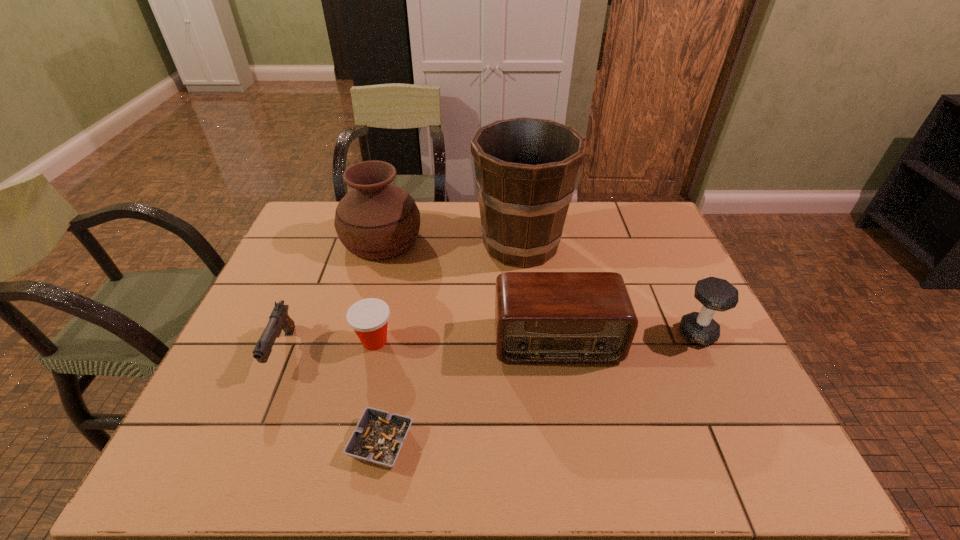
Where is `vacant space at the far edge of the desktop`? vacant space at the far edge of the desktop is located at coordinates (576, 234).

Image resolution: width=960 pixels, height=540 pixels. In order to click on blank space at the near edge of the desktop in this screenshot , I will do `click(462, 466)`.

At what (x,y) coordinates should I click in order to perform the action: click on blank space at the left edge. Please return your answer as a coordinate pair (x, y). The height and width of the screenshot is (540, 960). Looking at the image, I should click on (190, 426).

Where is `blank space at the right edge of the desktop`? The width and height of the screenshot is (960, 540). blank space at the right edge of the desktop is located at coordinates (668, 329).

The height and width of the screenshot is (540, 960). I want to click on vacant space at the far left corner, so coord(335,208).

At what (x,y) coordinates should I click in order to perform the action: click on unoccupied area between the leftmost object and the urn. Please return your answer as a coordinate pair (x, y). The height and width of the screenshot is (540, 960). Looking at the image, I should click on (332, 295).

You are a GUI agent. You are given a task and a screenshot of the screen. Output one action in this format:
    pyautogui.click(x=<x>, y=<y>)
    Task: Click on the free spot between the sixth shortest object and the bucket
    The width and height of the screenshot is (960, 540).
    Given the screenshot: What is the action you would take?
    pyautogui.click(x=451, y=242)

Where is `free spot between the second tallest object and the bucket`? This screenshot has height=540, width=960. free spot between the second tallest object and the bucket is located at coordinates (451, 242).

Image resolution: width=960 pixels, height=540 pixels. In order to click on empty location between the Dixie cup and the gun in this screenshot , I will do `click(328, 346)`.

Where is `vacant region between the shortest object and the dumbbell`? This screenshot has width=960, height=540. vacant region between the shortest object and the dumbbell is located at coordinates (540, 388).